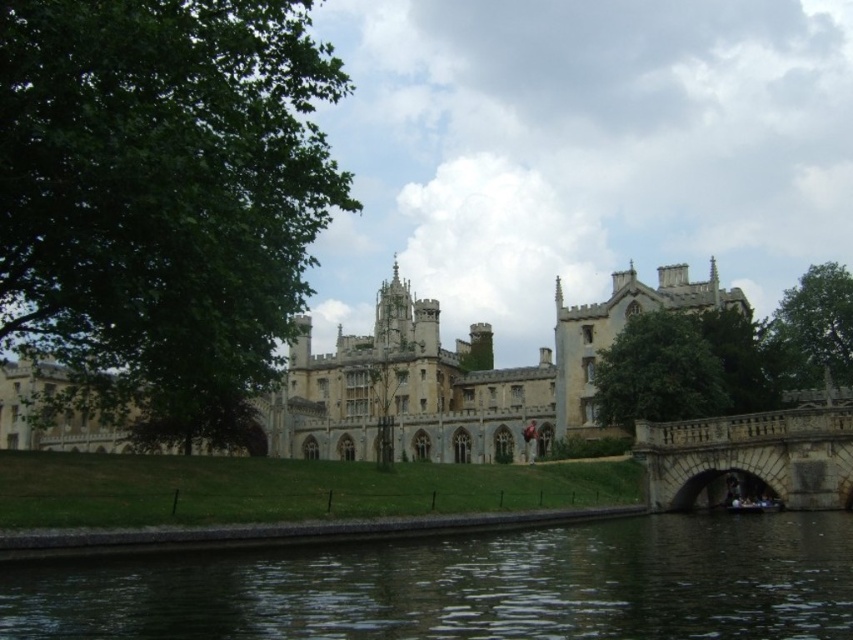
Question: Which of the following is the farthest from the observer?

Choices:
 (A) stone castle at center
 (B) green leafy tree at left

Answer: (A)

Question: Considering the real-world distances, which object is farthest from the green leafy tree at center?

Choices:
 (A) dark green water at lower center
 (B) stone castle at center
 (C) stone textured bridge at lower right

Answer: (A)

Question: In this image, where is green leafy tree at left located relative to stone castle at center?

Choices:
 (A) left
 (B) right

Answer: (A)

Question: Does green leafy tree at left have a greater width compared to stone castle at center?

Choices:
 (A) no
 (B) yes

Answer: (A)

Question: Considering the relative positions of stone textured bridge at lower right and green leafy tree at upper right in the image provided, where is stone textured bridge at lower right located with respect to green leafy tree at upper right?

Choices:
 (A) above
 (B) below

Answer: (B)

Question: Which object is positioned farthest from the dark green water at lower center?

Choices:
 (A) green leafy tree at left
 (B) green leafy tree at center
 (C) green leafy tree at upper right

Answer: (C)